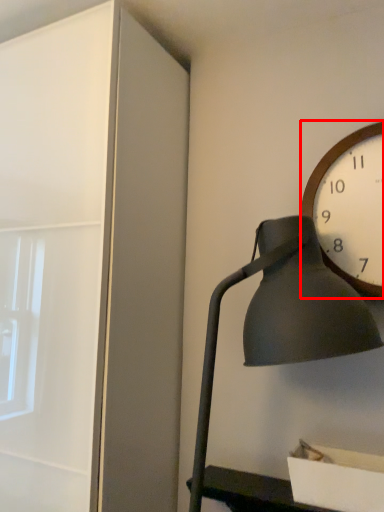
Question: Considering the relative positions of wall clock (annotated by the red box) and lamp in the image provided, where is wall clock (annotated by the red box) located with respect to the staircase?

Choices:
 (A) right
 (B) left

Answer: (A)